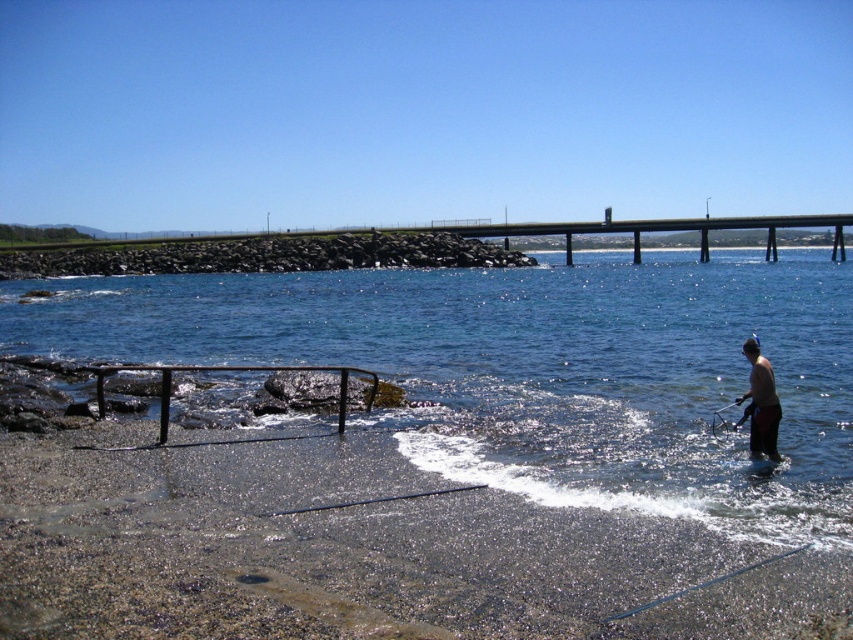
From the picture: You are a photographer planning to take a photo of the clear blue water at lower center and the skinny man at lower right. Based on the scene, where should you position yourself to include both subjects in the frame without any obstructions?

Position yourself above the clear blue water at lower center so that you can look down and capture both the water and the skinny man at lower right who is positioned below it.

You are planning to take a photo of the clear blue water at lower center and the skinny man at lower right. Which object is wider?

The clear blue water at lower center is wider than the skinny man at lower right.